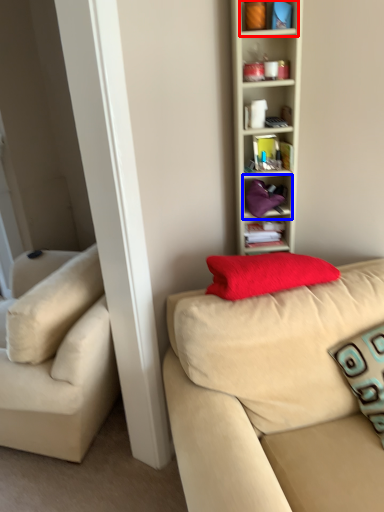
Question: Which of the following is the farthest to the observer, cabinet (highlighted by a red box) or cabinet (highlighted by a blue box)?

Choices:
 (A) cabinet
 (B) cabinet

Answer: (B)